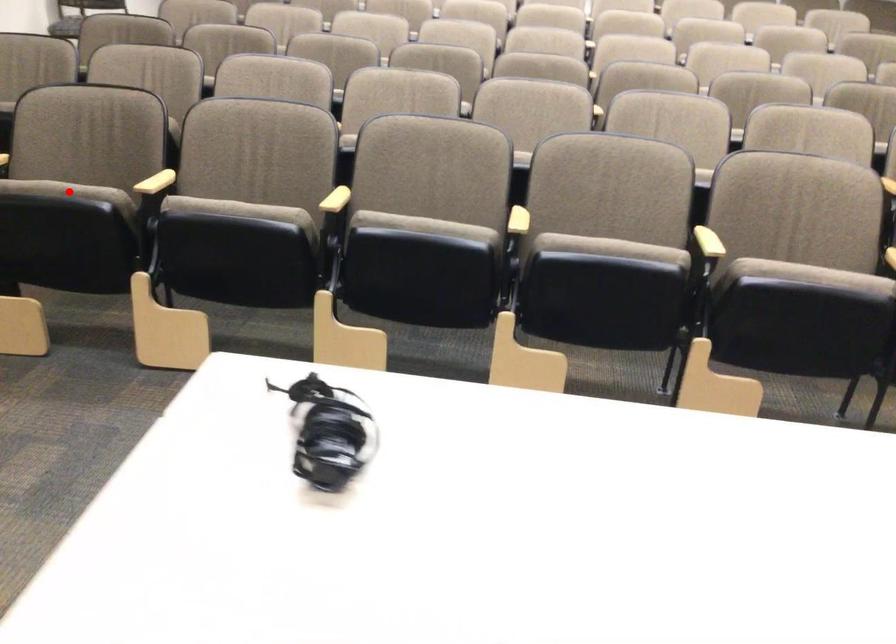
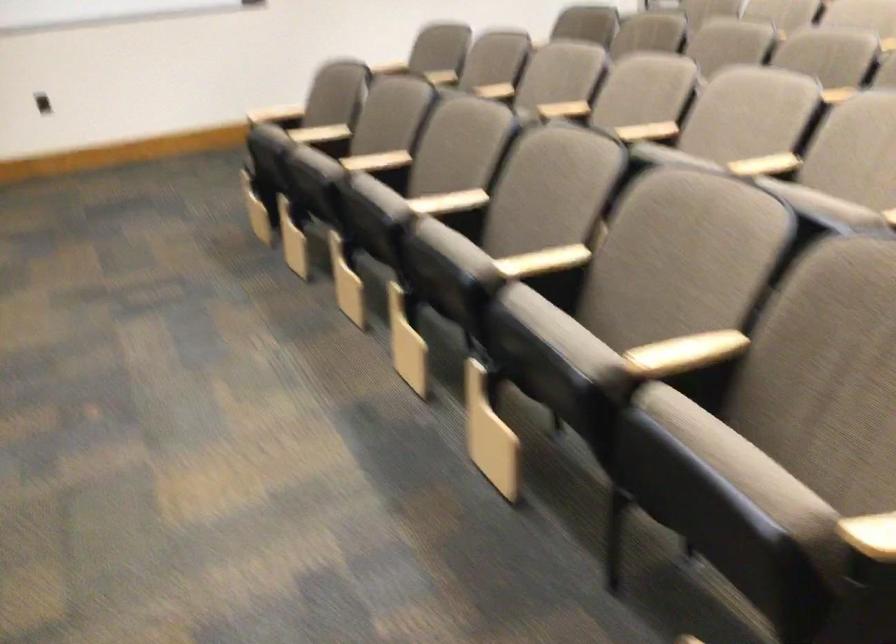
Question: I am providing you with two images of the same scene from different viewpoints. A red point is marked on the first image. Can you still see the location of the red point in image 2?

Choices:
 (A) Yes
 (B) No

Answer: (B)